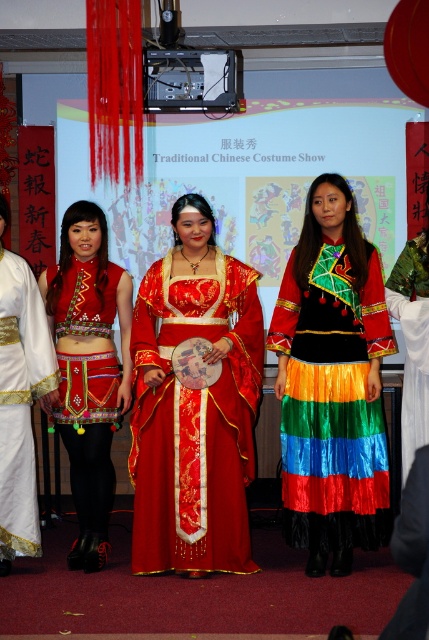
You are a photographer at the Traditional Chinese Costume Show event. You need to capture a photo where the silk red dress at center is visible above the silky rainbow skirt at center. Is this possible given their current positions?

The silk red dress at center is below the silky rainbow skirt at center, so it would not be visible above it in the current arrangement.